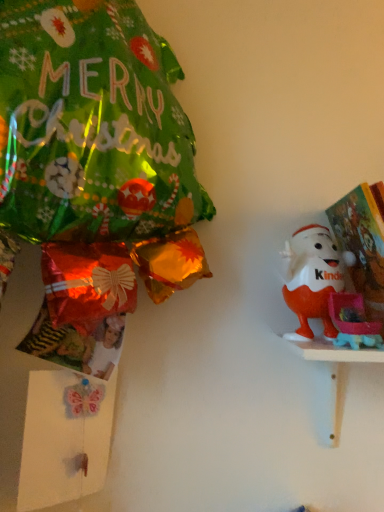
Question: Considering the positions of orange matte kinder egg at right and white wooden shelf at right in the image, is orange matte kinder egg at right wider or thinner than white wooden shelf at right?

Choices:
 (A) wide
 (B) thin

Answer: (B)

Question: Considering the positions of point (324, 256) and point (334, 419), is point (324, 256) closer or farther from the camera than point (334, 419)?

Choices:
 (A) farther
 (B) closer

Answer: (B)

Question: Is orange matte kinder egg at right to the left or to the right of white wooden shelf at right in the image?

Choices:
 (A) left
 (B) right

Answer: (A)

Question: Is point (342, 365) closer or farther from the camera than point (309, 333)?

Choices:
 (A) farther
 (B) closer

Answer: (A)

Question: From a real-world perspective, is white wooden shelf at right above or below orange matte kinder egg at right?

Choices:
 (A) above
 (B) below

Answer: (B)

Question: Looking at their shapes, would you say white wooden shelf at right is wider or thinner than orange matte kinder egg at right?

Choices:
 (A) thin
 (B) wide

Answer: (B)

Question: From the image's perspective, is white wooden shelf at right positioned above or below orange matte kinder egg at right?

Choices:
 (A) below
 (B) above

Answer: (A)